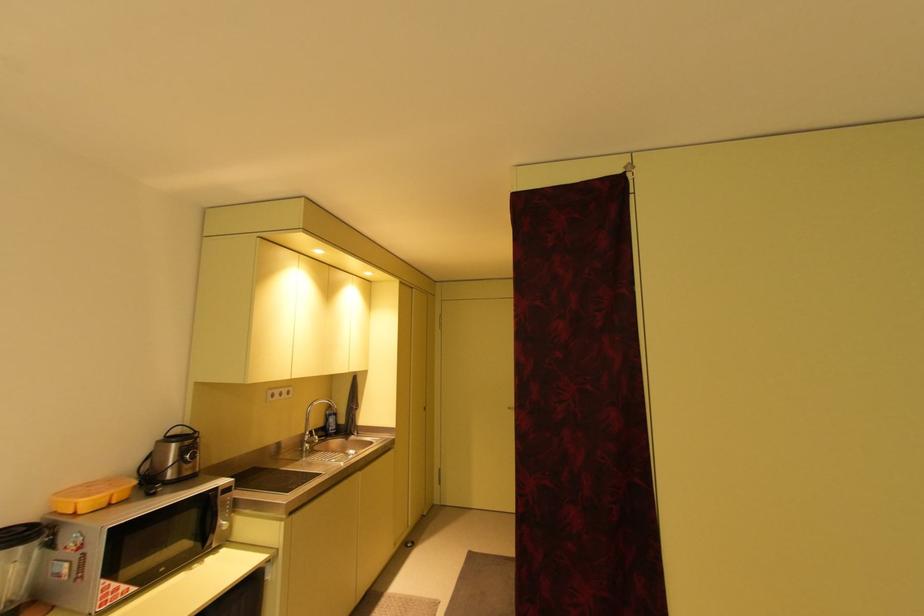
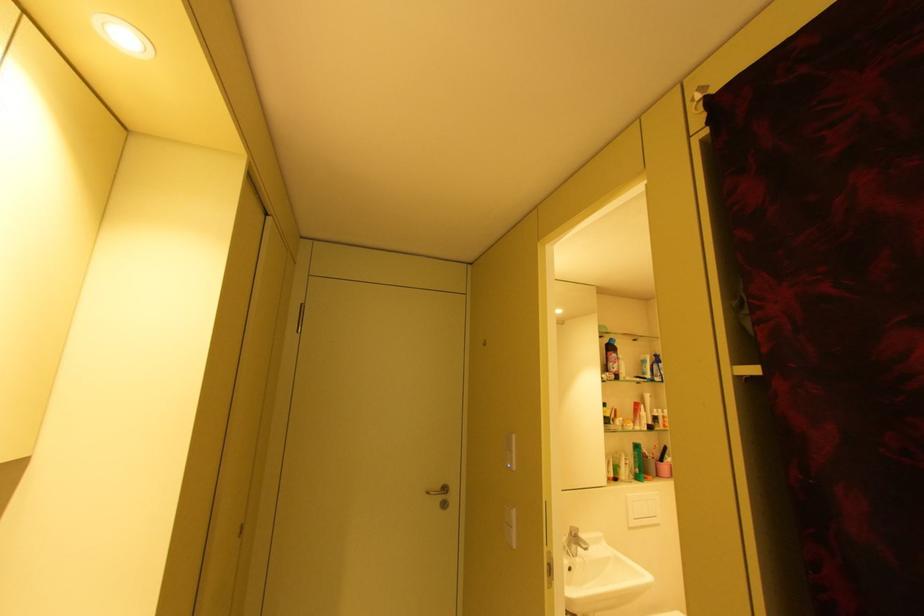
The point at (515, 408) is marked in the first image. Where is the corresponding point in the second image?

(434, 493)